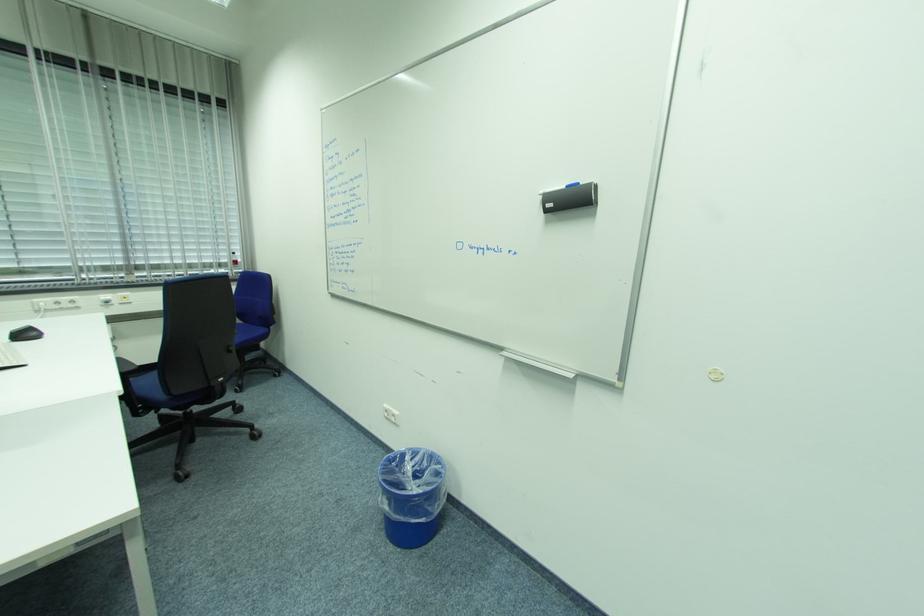
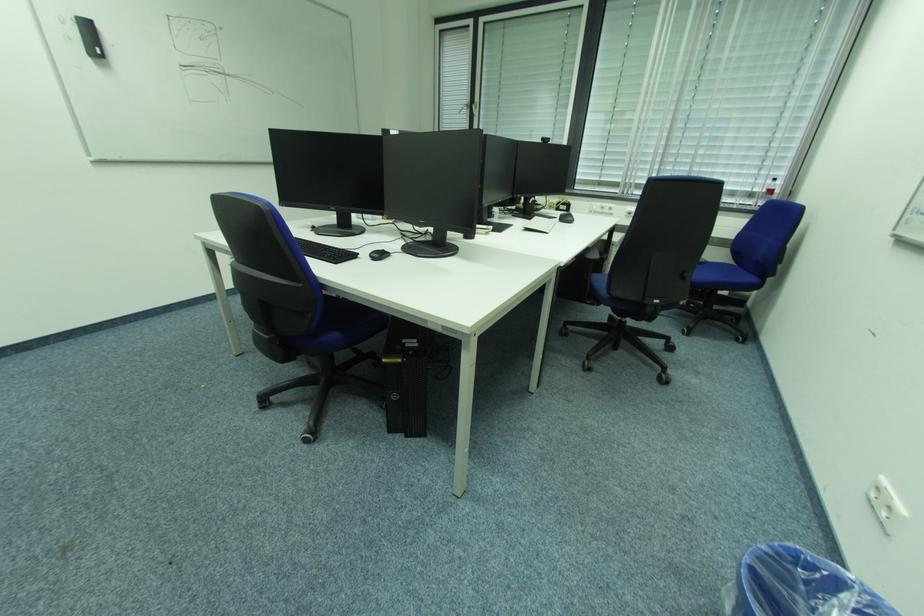
First-person continuous shooting, in which direction is the camera rotating?

The camera's rotation is toward left-down.